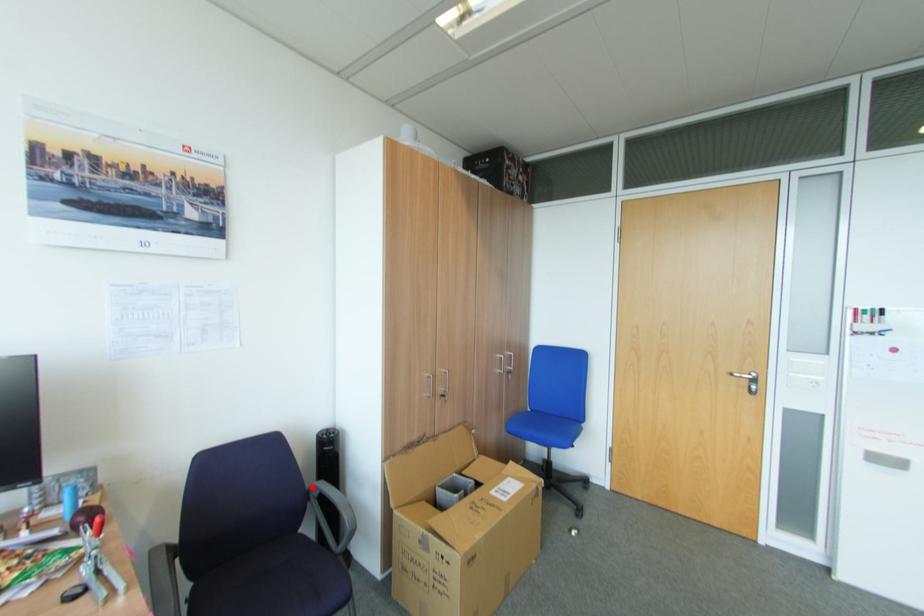
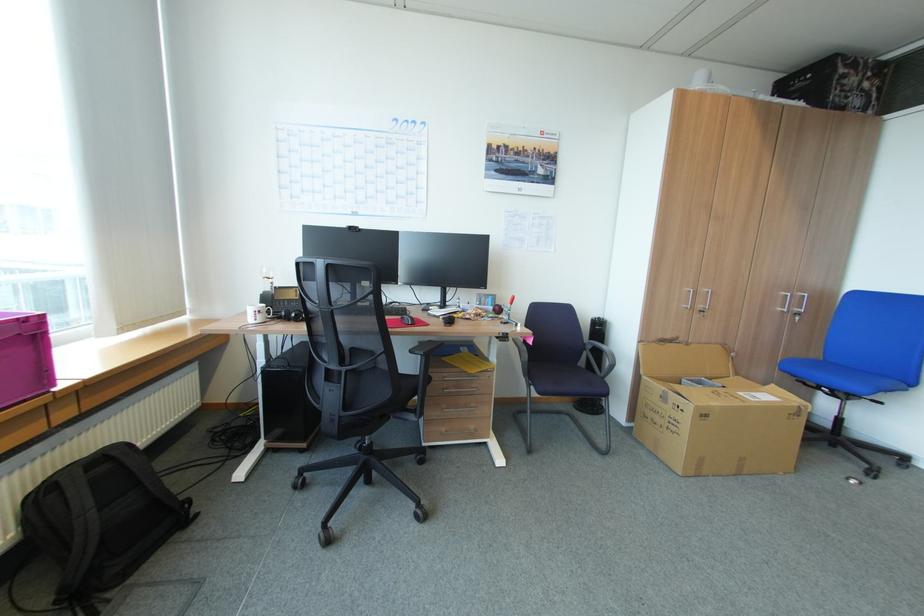
Find the pixel in the second image that matches the highlighted location in the first image.

(590, 342)